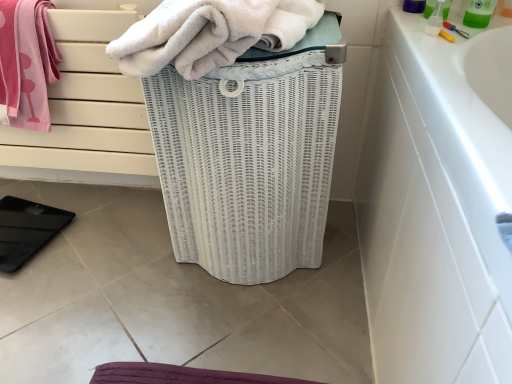
Identify the location of free location in front of white wicker basket at center. (236, 329).